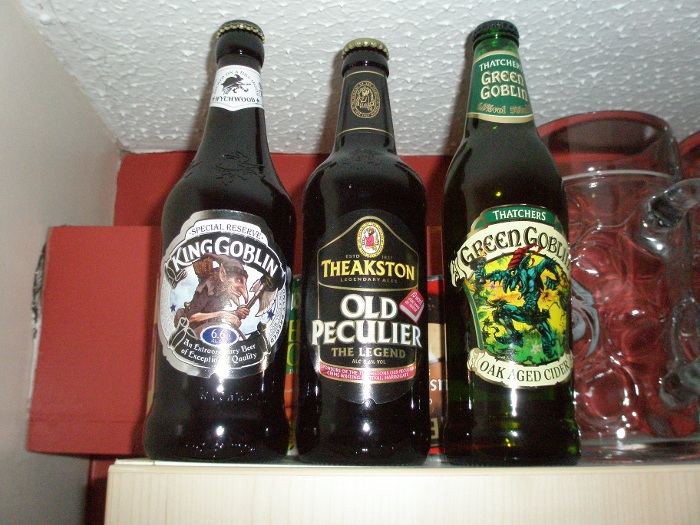
Where is `ceiling`? ceiling is located at coordinates (574, 60).